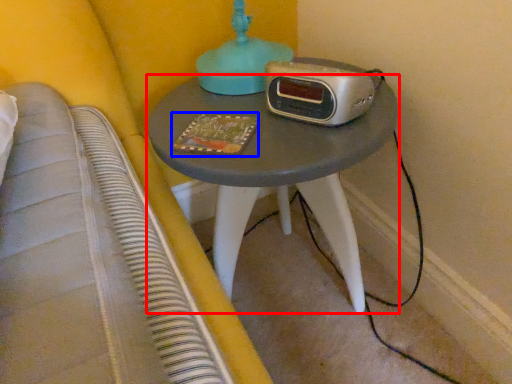
Question: Among these objects, which one is farthest to the camera, nightstand (highlighted by a red box) or book (highlighted by a blue box)?

Choices:
 (A) nightstand
 (B) book

Answer: (B)